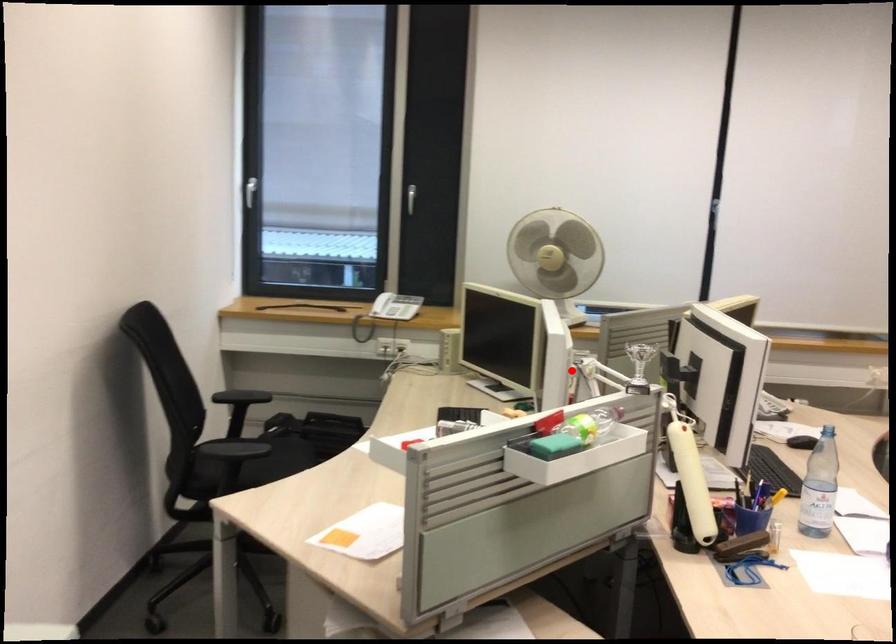
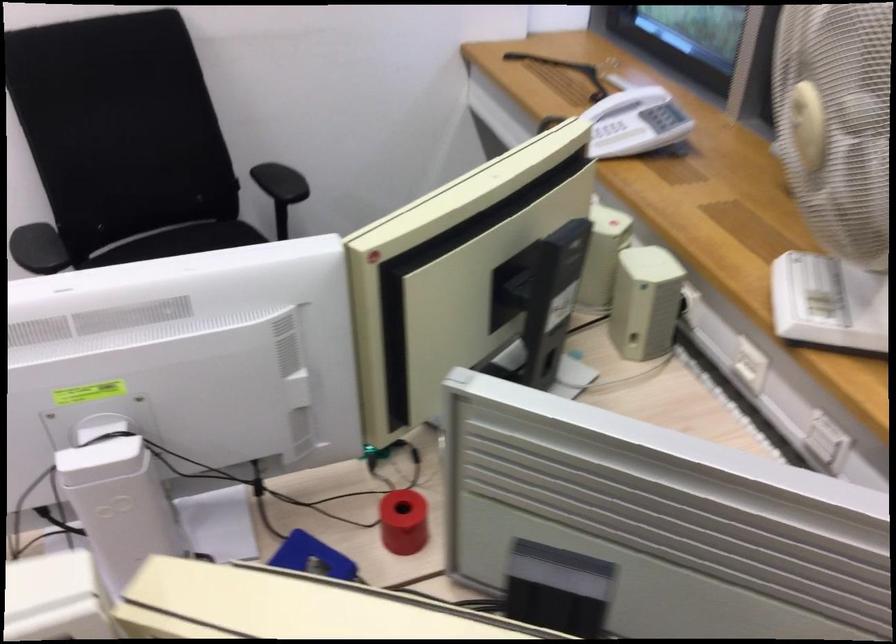
Question: I am providing you with two images of the same scene from different viewpoints. A red point is marked on the first image. Is the red point's position out of view in image 2?

Choices:
 (A) Yes
 (B) No

Answer: (B)